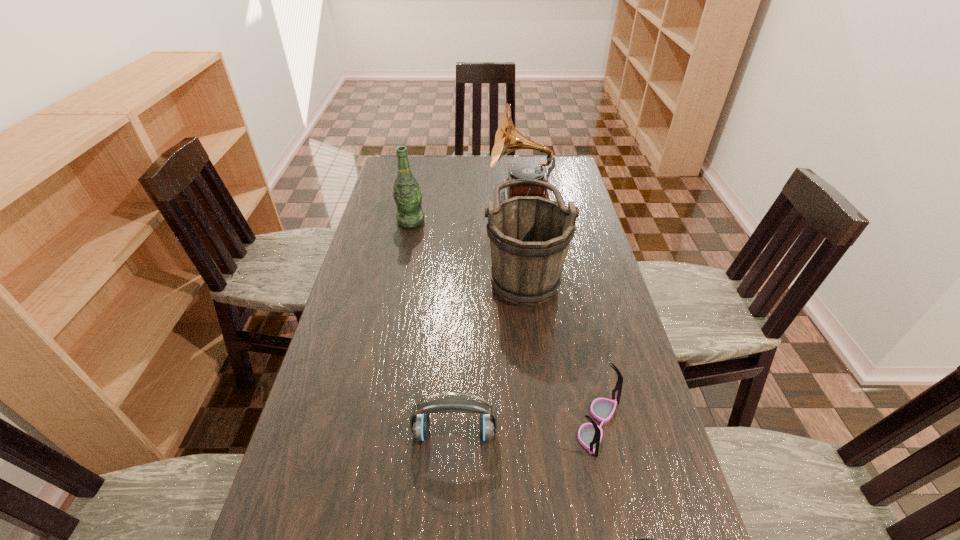
At what (x,y) coordinates should I click in order to perform the action: click on free space between the phonograph_record and the taller spectacles. Please return your answer as a coordinate pair (x, y). Looking at the image, I should click on click(560, 308).

Locate an element on the screen. The height and width of the screenshot is (540, 960). vacant space that is in between the farther spectacles and the leftmost object is located at coordinates (505, 323).

Where is `object that stands as the fifth closest to the bucket`? object that stands as the fifth closest to the bucket is located at coordinates (634, 539).

You are a GUI agent. You are given a task and a screenshot of the screen. Output one action in this format:
    pyautogui.click(x=<x>, y=<y>)
    Task: Click on the object that is the fourth closest to the headset
    
    Given the screenshot: What is the action you would take?
    pyautogui.click(x=408, y=196)

The width and height of the screenshot is (960, 540). I want to click on the closest spectacles to the bucket, so click(590, 434).

I want to click on spectacles identified as the second closest to the leftmost object, so click(634, 539).

At what (x,y) coordinates should I click in order to perform the action: click on vacant position in the image that satisfies the following two spatial constraints: 1. on the horn of the phonograph_record; 2. on the surface of the fifth nearest object. Please return your answer as a coordinate pair (x, y). Image resolution: width=960 pixels, height=540 pixels. Looking at the image, I should click on (525, 221).